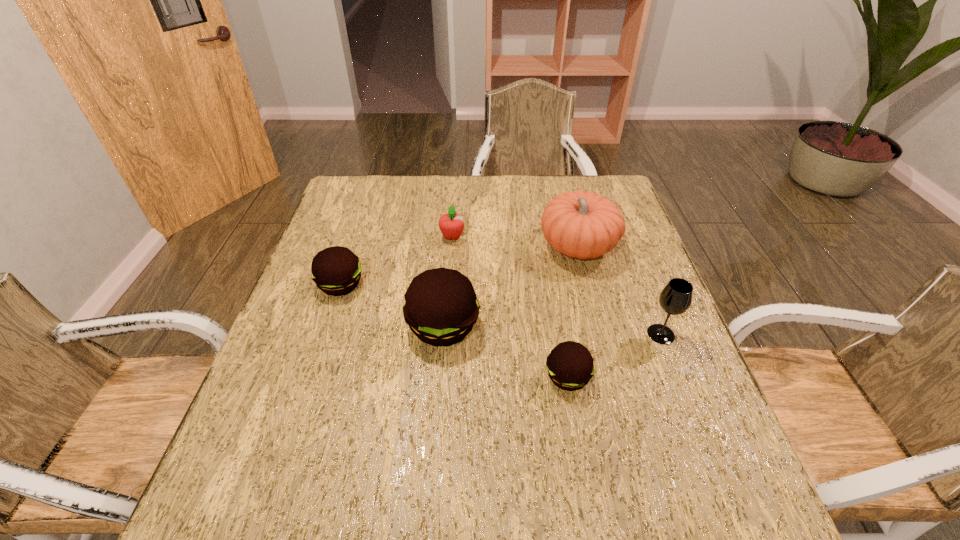
Where is `free location located on the right of the shortest patty`? This screenshot has height=540, width=960. free location located on the right of the shortest patty is located at coordinates (662, 376).

Locate an element on the screen. The height and width of the screenshot is (540, 960). vacant space situated on the front of the pumpkin is located at coordinates (591, 302).

Locate an element on the screen. vacant space situated on the left of the apple is located at coordinates (357, 237).

At what (x,y) coordinates should I click in order to perform the action: click on vacant space located on the front of the wineglass. Please return your answer as a coordinate pair (x, y). Looking at the image, I should click on (691, 413).

Locate an element on the screen. object located in the left edge section of the desktop is located at coordinates (336, 270).

You are a GUI agent. You are given a task and a screenshot of the screen. Output one action in this format:
    pyautogui.click(x=<x>, y=<y>)
    Task: Click on the pumpkin that is positioned at the right edge
    The width and height of the screenshot is (960, 540).
    Given the screenshot: What is the action you would take?
    pyautogui.click(x=583, y=225)

This screenshot has height=540, width=960. I want to click on wineglass that is at the right edge, so click(x=676, y=297).

You are a GUI agent. You are given a task and a screenshot of the screen. Output one action in this format:
    pyautogui.click(x=<x>, y=<y>)
    Task: Click on the vacant area at the far edge of the desktop
    
    Given the screenshot: What is the action you would take?
    pyautogui.click(x=563, y=190)

Where is `vacant space at the near edge`? vacant space at the near edge is located at coordinates (423, 439).

In the image, there is a desktop. Identify the location of vacant space at the left edge. The image size is (960, 540). (271, 363).